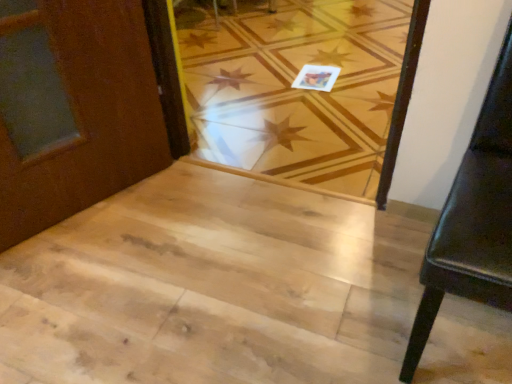
The image size is (512, 384). I want to click on vacant point above natural wood stairwell at center (from a real-world perspective), so click(206, 264).